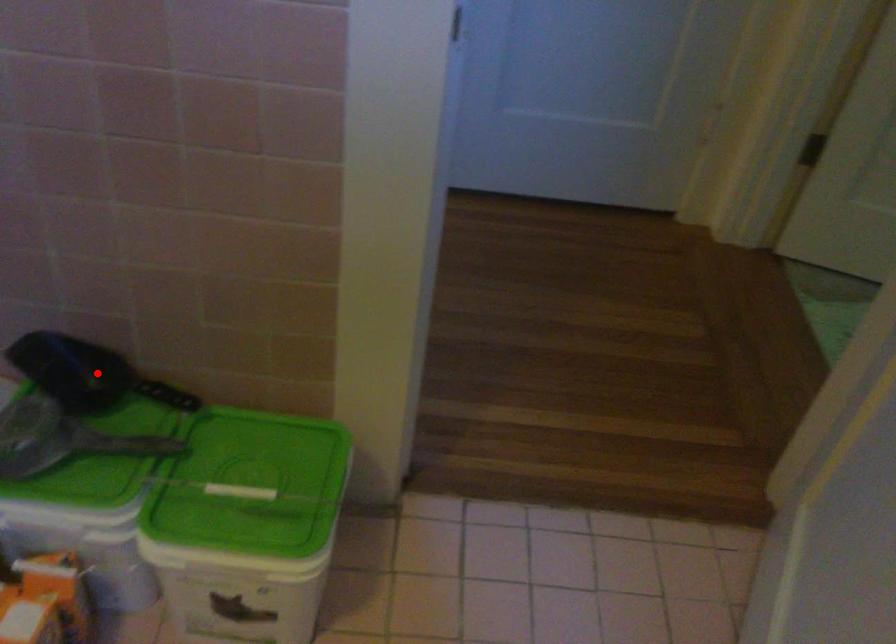
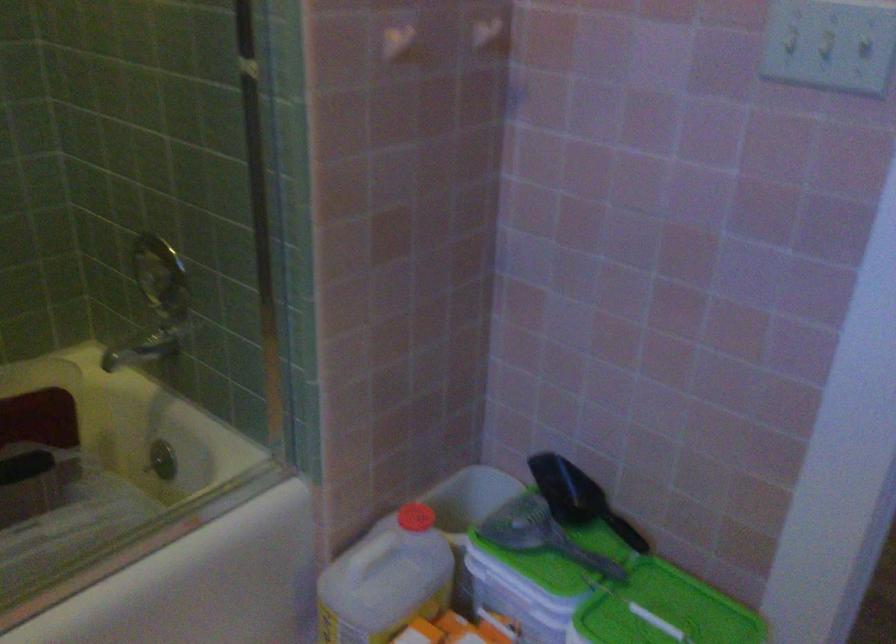
Question: I am providing you with two images of the same scene from different viewpoints. A red point is marked on the first image. Is the red point's position out of view in image 2?

Choices:
 (A) Yes
 (B) No

Answer: (B)